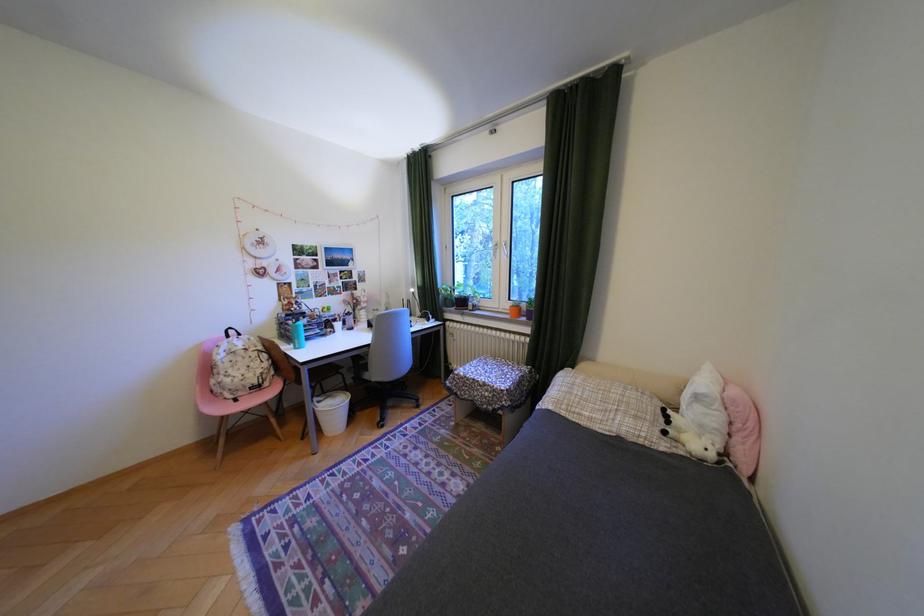
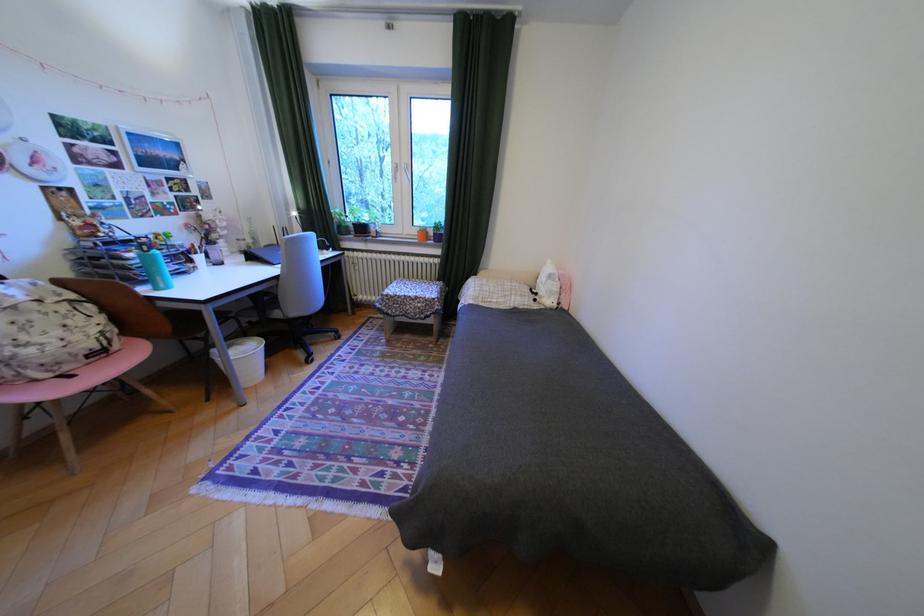
Locate, in the second image, the point that corresponds to point (381, 346) in the first image.

(288, 278)